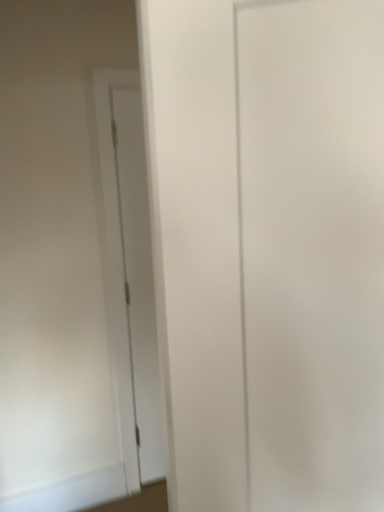
Locate an element on the screen. white matte door at center is located at coordinates (313, 251).

The image size is (384, 512). Describe the element at coordinates (313, 251) in the screenshot. I see `white matte door at center` at that location.

Measure the distance between white matte door at center and camera.

The distance of white matte door at center from camera is 63.58 centimeters.

The width and height of the screenshot is (384, 512). I want to click on white matte door at center, so click(313, 251).